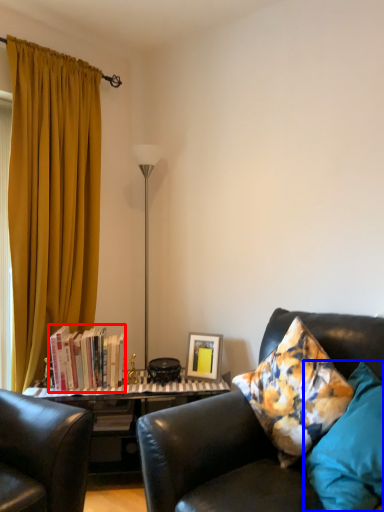
Question: Which object is closer to the camera taking this photo, book (highlighted by a red box) or pillow (highlighted by a blue box)?

Choices:
 (A) book
 (B) pillow

Answer: (B)